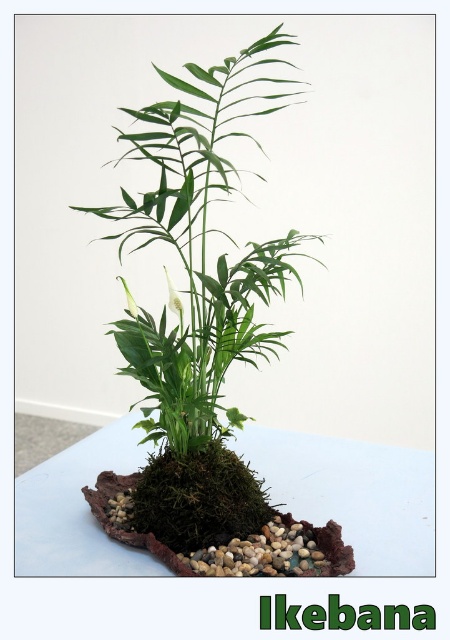
You are an Ikebana artist trying to ensure proper spacing between the green mossy plant at center and the white glossy flower at center. Based on their sizes, which one requires more horizontal space?

The green mossy plant at center might be wider than the white glossy flower at center, so it likely requires more horizontal space.

You are an Ikebana artist who wants to ensure the spacing between the green mossy plant at center and the white matte flower at center meets the traditional requirement of 10 inches. Based on the image, will the current arrangement comply with this standard?

The green mossy plant at center and the white matte flower at center are 10.70 inches apart, which exceeds the required 10 inches. Therefore, the current arrangement does not comply with the traditional spacing requirement.

You are an Ikebana artist evaluating the composition. Which object is taller between the green mossy plant at center and the white matte flower at center?

The green mossy plant at center is much taller than the white matte flower at center.